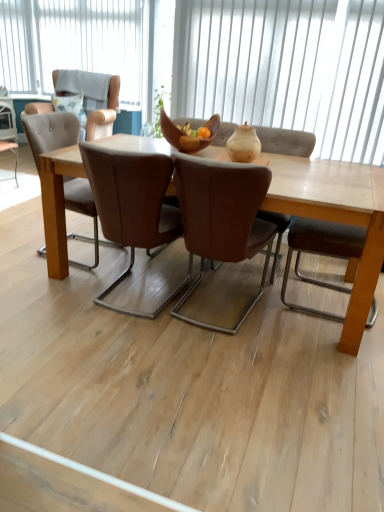
Find the location of a particular element. This screenshot has height=512, width=384. vacant space that is in between brown leather chair at center, the 2th chair positioned from the right, and brown leather chair at center, which is counted as the 1th chair, starting from the right is located at coordinates (178, 323).